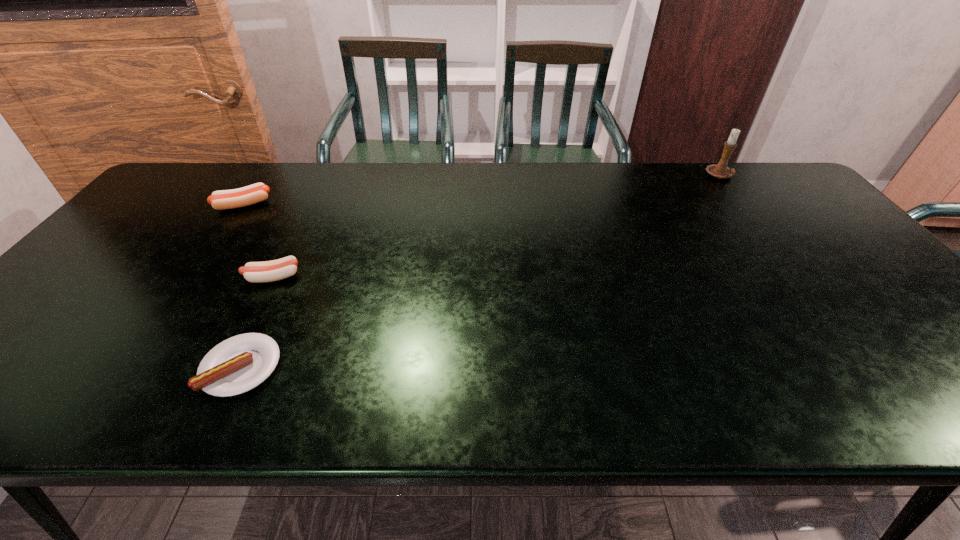
This screenshot has width=960, height=540. In order to click on the tallest object in this screenshot , I will do `click(721, 171)`.

The height and width of the screenshot is (540, 960). I want to click on candle holder, so click(721, 171).

Identify the location of the leftmost object. This screenshot has height=540, width=960. (224, 199).

Identify the location of the third nearest object. The width and height of the screenshot is (960, 540). (224, 199).

Find the location of a particular element. Image resolution: width=960 pixels, height=540 pixels. the third farthest object is located at coordinates (257, 272).

At what (x,y) coordinates should I click in order to perform the action: click on the shortest sausage. Please return your answer as a coordinate pair (x, y). The image size is (960, 540). Looking at the image, I should click on (236, 365).

Where is `the shortest object`? The height and width of the screenshot is (540, 960). the shortest object is located at coordinates (236, 365).

Where is `vacant area situated 0.310m on the side of the tallest object with the handle`? The image size is (960, 540). vacant area situated 0.310m on the side of the tallest object with the handle is located at coordinates (773, 244).

You are a GUI agent. You are given a task and a screenshot of the screen. Output one action in this format:
    pyautogui.click(x=<x>, y=<y>)
    Task: Click on the vacant space located on the right of the leftmost object
    This screenshot has width=960, height=540.
    Given the screenshot: What is the action you would take?
    pyautogui.click(x=361, y=205)

Locate an element on the screen. The width and height of the screenshot is (960, 540). vacant space positioned 0.330m on the right of the third farthest object is located at coordinates (430, 277).